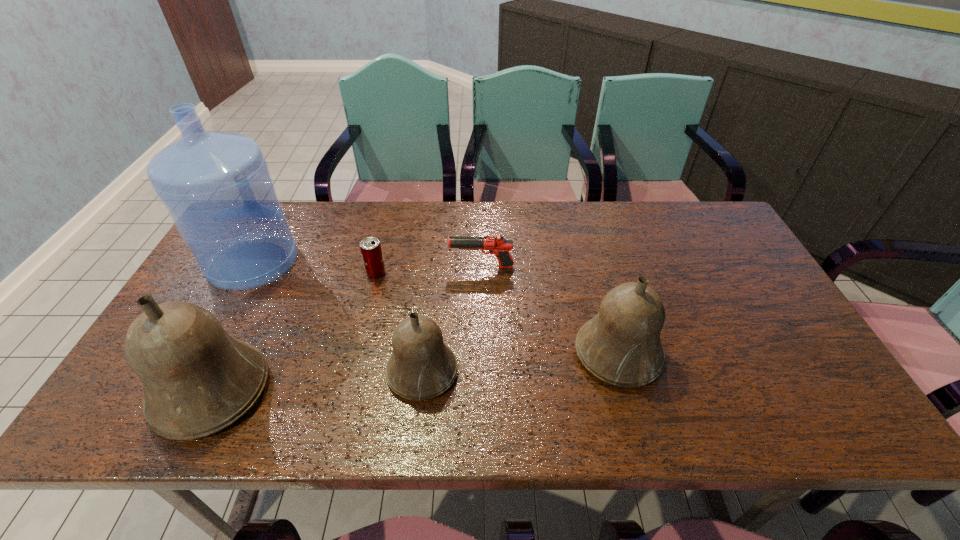
You are a GUI agent. You are given a task and a screenshot of the screen. Output one action in this format:
    pyautogui.click(x=<x>, y=<y>)
    Task: Click on the vacant space located 0.360m on the right of the second bell from right to left
    The width and height of the screenshot is (960, 540).
    Given the screenshot: What is the action you would take?
    pyautogui.click(x=612, y=372)

The height and width of the screenshot is (540, 960). I want to click on free region located 0.070m on the right of the third tallest object, so click(x=690, y=354).

I want to click on vacant space situated 0.170m at the aiming end of the gun, so click(x=392, y=267).

Find the location of `free space located 0.150m at the aiming end of the gun`. free space located 0.150m at the aiming end of the gun is located at coordinates (398, 267).

Find the location of `free spot located at the aiming end of the gun`. free spot located at the aiming end of the gun is located at coordinates (x=374, y=267).

Find the location of a particular element. This screenshot has height=540, width=960. vacant area situated on the side of the tallest object with the handle is located at coordinates (277, 218).

Where is `blank space located 0.150m on the side of the tallest object with the handle`? blank space located 0.150m on the side of the tallest object with the handle is located at coordinates pyautogui.click(x=283, y=207).

Find the location of a particular element. The width and height of the screenshot is (960, 540). free region located 0.180m on the side of the tallest object with the handle is located at coordinates (286, 202).

Where is `vacant region located on the back of the beer can`? The width and height of the screenshot is (960, 540). vacant region located on the back of the beer can is located at coordinates (382, 251).

You are a GUI agent. You are given a task and a screenshot of the screen. Output one action in this format:
    pyautogui.click(x=<x>, y=<y>)
    Task: Click on the object at the far edge
    This screenshot has width=960, height=540.
    Given the screenshot: What is the action you would take?
    click(x=216, y=186)